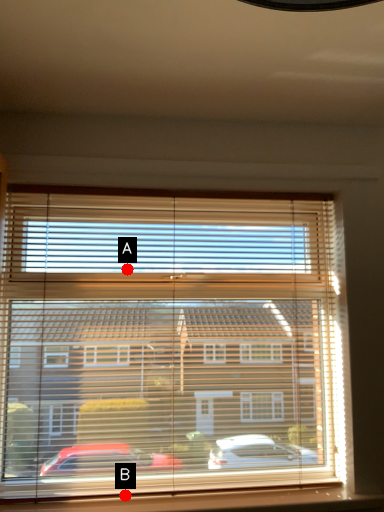
Question: Two points are circled on the image, labeled by A and B beside each circle. Which point is closer to the camera?

Choices:
 (A) A is closer
 (B) B is closer

Answer: (B)